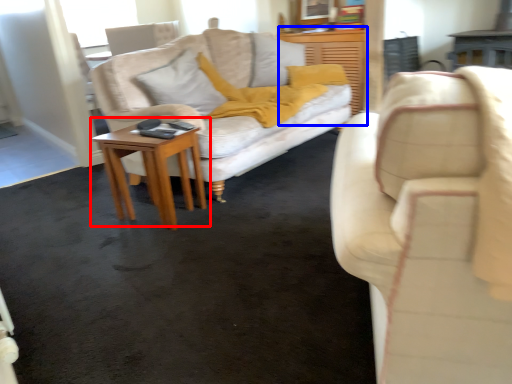
Question: Which object is closer to the camera taking this photo, table (highlighted by a red box) or dresser (highlighted by a blue box)?

Choices:
 (A) table
 (B) dresser

Answer: (A)